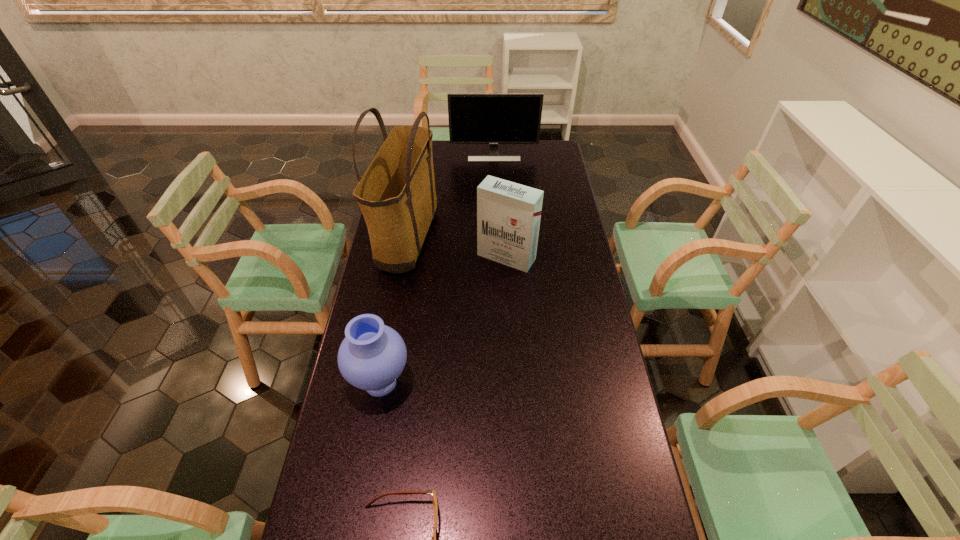
The width and height of the screenshot is (960, 540). What are the coordinates of `unoccupied position between the tote bag and the monitor` in the screenshot? It's located at (451, 198).

Point out which object is positioned as the nearest to the monitor. Please provide its 2D coordinates. Your answer should be formatted as a tuple, i.e. [(x, y)], where the tuple contains the x and y coordinates of a point satisfying the conditions above.

[(396, 194)]

The image size is (960, 540). What are the coordinates of `the second closest object to the cigarette case` in the screenshot? It's located at (371, 357).

The width and height of the screenshot is (960, 540). Identify the location of blank space that satisfies the following two spatial constraints: 1. on the screen side of the cigarette case; 2. on the left side of the monitor. (498, 257).